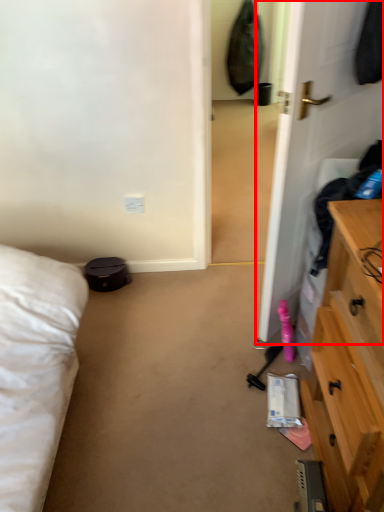
Question: From the image's perspective, what is the correct spatial relationship of door (annotated by the red box) in relation to electric outlet?

Choices:
 (A) below
 (B) above

Answer: (B)